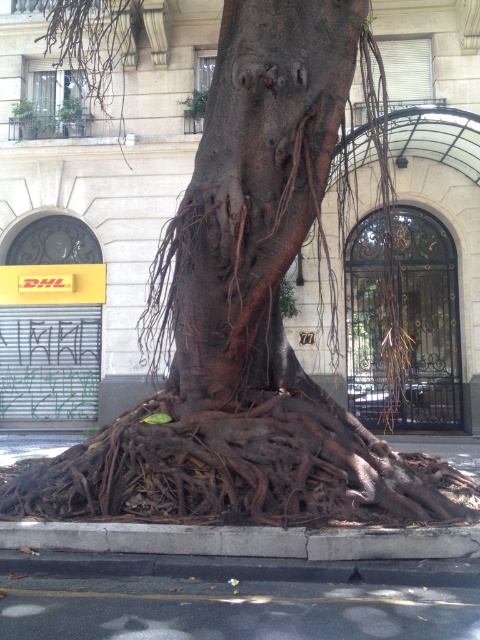
The height and width of the screenshot is (640, 480). What do you see at coordinates (251, 195) in the screenshot? I see `brown rough bark at center` at bounding box center [251, 195].

Who is lower down, brown rough bark at center or gray concrete curb at lower center?

Positioned lower is gray concrete curb at lower center.

I want to click on brown rough bark at center, so click(251, 195).

This screenshot has height=640, width=480. I want to click on brown rough roots at lower center, so click(237, 472).

Can you confirm if brown rough roots at lower center is positioned to the left of black asphalt at lower center?

In fact, brown rough roots at lower center is to the right of black asphalt at lower center.

Is point (333, 461) positioned behind point (44, 621)?

Yes.

What are the coordinates of `brown rough roots at lower center` in the screenshot? It's located at (237, 472).

Does brown rough roots at lower center appear over gray concrete curb at lower center?

Yes.

Which of these two, brown rough roots at lower center or gray concrete curb at lower center, stands shorter?

With less height is gray concrete curb at lower center.

Between point (49, 488) and point (417, 552), which one is positioned behind?

The point (49, 488) is more distant.

Locate an element on the screen. The image size is (480, 640). brown rough roots at lower center is located at coordinates (237, 472).